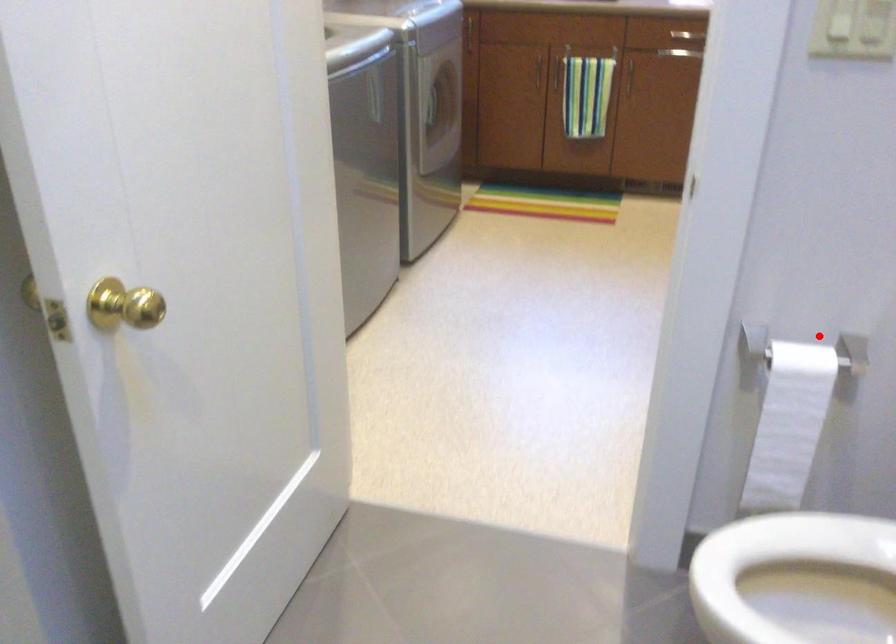
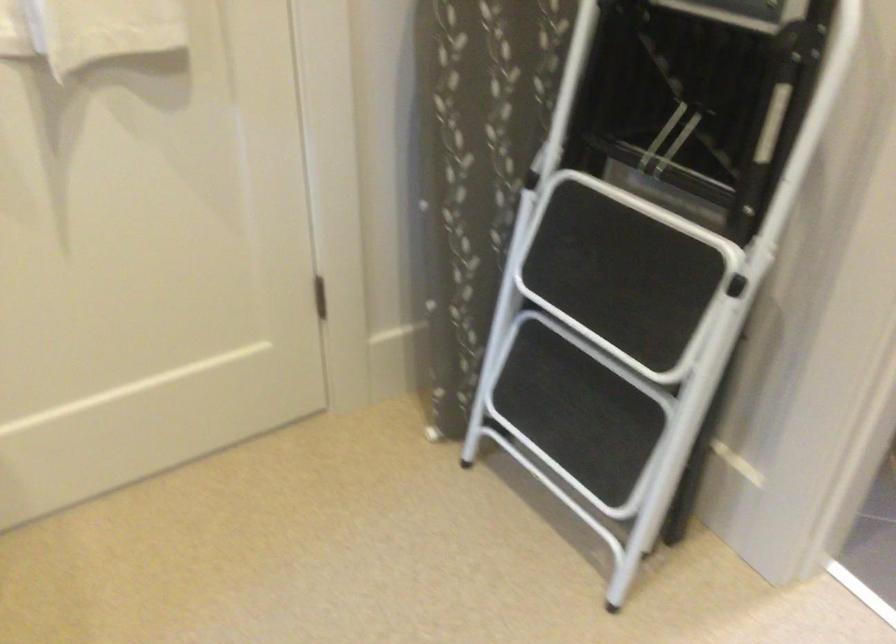
Where in the second image is the point corresponding to the highlighted location from the first image?

(607, 342)